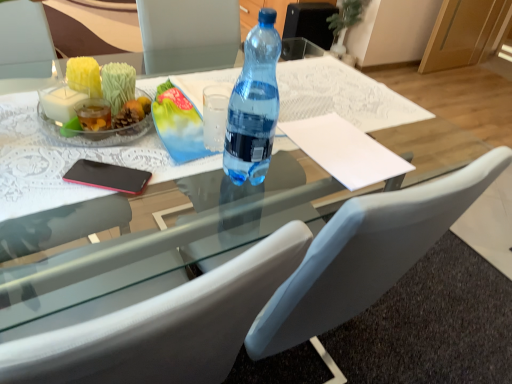
Question: Is transparent glass table at center facing away from transparent plastic bottle at center?

Choices:
 (A) no
 (B) yes

Answer: (A)

Question: Would you consider transparent glass table at center to be distant from transparent plastic bottle at center?

Choices:
 (A) no
 (B) yes

Answer: (A)

Question: Does transparent glass table at center have a lesser height compared to transparent plastic bottle at center?

Choices:
 (A) yes
 (B) no

Answer: (A)

Question: Does transparent glass table at center appear on the left side of transparent plastic bottle at center?

Choices:
 (A) no
 (B) yes

Answer: (B)

Question: Does transparent glass table at center lie behind transparent plastic bottle at center?

Choices:
 (A) no
 (B) yes

Answer: (B)

Question: Could you tell me if transparent glass table at center is turned towards transparent plastic bottle at center?

Choices:
 (A) no
 (B) yes

Answer: (A)

Question: From a real-world perspective, is white leather chair at center positioned over white paper at center based on gravity?

Choices:
 (A) no
 (B) yes

Answer: (A)

Question: Could you tell me if white leather chair at center is turned towards white paper at center?

Choices:
 (A) yes
 (B) no

Answer: (A)

Question: Is white paper at center surrounded by white leather chair at center?

Choices:
 (A) yes
 (B) no

Answer: (A)

Question: Is white leather chair at center not inside white paper at center?

Choices:
 (A) no
 (B) yes

Answer: (B)

Question: From the image's perspective, is white leather chair at center over white paper at center?

Choices:
 (A) yes
 (B) no

Answer: (B)

Question: From a real-world perspective, is white leather chair at center physically below white paper at center?

Choices:
 (A) no
 (B) yes

Answer: (B)

Question: Is white leather chair at center inside white paper at center?

Choices:
 (A) yes
 (B) no

Answer: (B)